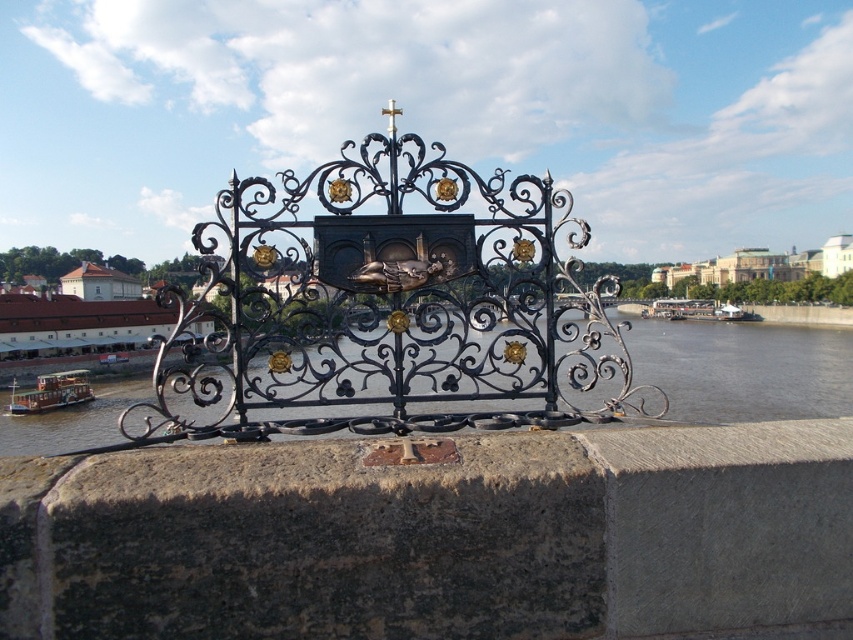
Question: Which point is closer to the camera?

Choices:
 (A) black wrought iron gate at center
 (B) brown wooden boat at left
 (C) brown water at center

Answer: (A)

Question: Is the position of black wrought iron gate at center more distant than that of brown wooden boat at left?

Choices:
 (A) yes
 (B) no

Answer: (B)

Question: Can you confirm if black wrought iron gate at center is positioned below brown wooden boat at left?

Choices:
 (A) yes
 (B) no

Answer: (B)

Question: Which point appears closest to the camera in this image?

Choices:
 (A) (4, 410)
 (B) (521, 538)

Answer: (B)

Question: Does black wrought iron gate at center have a larger size compared to brown wooden boat at left?

Choices:
 (A) no
 (B) yes

Answer: (B)

Question: Which point is closer to the camera?

Choices:
 (A) (643, 332)
 (B) (427, 486)

Answer: (B)